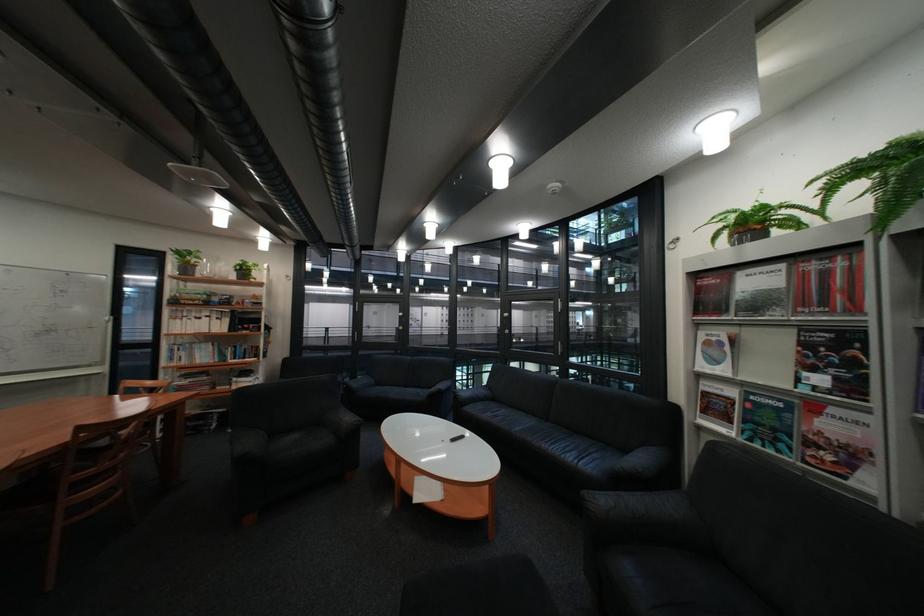
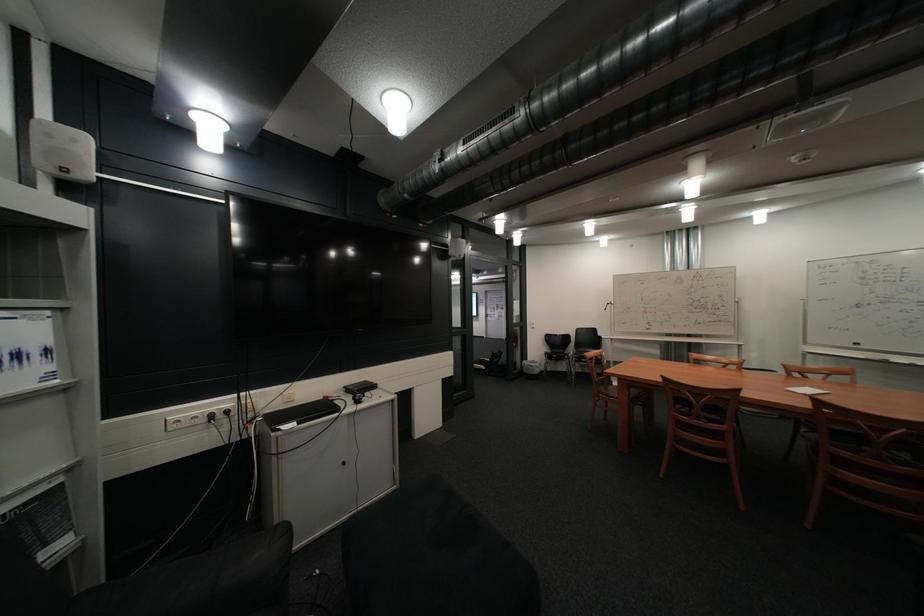
The point at (122,464) is marked in the first image. Where is the corresponding point in the second image?

(888, 460)